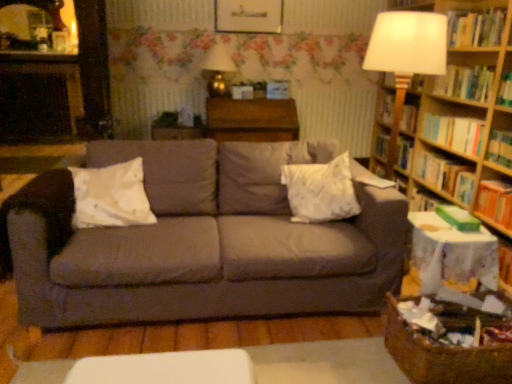
Question: Considering the positions of wooden table at center and orange hardcover book at right, marked as the 1th book in a bottom-to-top arrangement, in the image, is wooden table at center taller or shorter than orange hardcover book at right, marked as the 1th book in a bottom-to-top arrangement,?

Choices:
 (A) tall
 (B) short

Answer: (A)

Question: Choose the correct answer: Is wooden table at center inside orange hardcover book at right, marked as the 1th book in a bottom-to-top arrangement, or outside it?

Choices:
 (A) inside
 (B) outside

Answer: (B)

Question: Estimate the real-world distances between objects in this image. Which object is closer to the gray fabric couch at center?

Choices:
 (A) white fabric pillow at center, the 2th pillow viewed from the left
 (B) hardcover book at upper right, which is the fifth book in bottom-to-top order
 (C) hardcover book at right, the 2th book positioned from the bottom
 (D) hardcover book at right, which ranks as the 3th book in bottom-to-top order
 (E) white soft pillow at left, placed as the second pillow when sorted from right to left

Answer: (E)

Question: Which object is positioned closest to the metallic gold table lamp at upper center?

Choices:
 (A) hardcover book at right, arranged as the third book when viewed from the top
 (B) wooden table at center
 (C) green matte paperback book at right
 (D) gray fabric couch at center
 (E) hardcover book at upper right, the second book viewed from the top

Answer: (B)